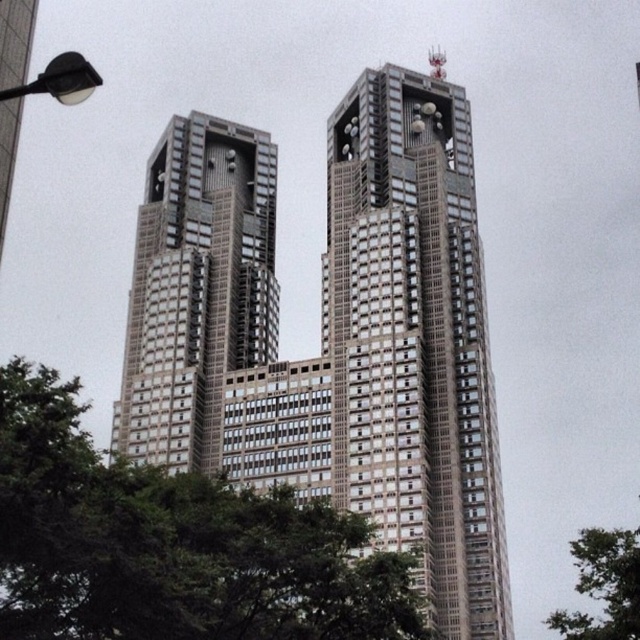
You are standing at the point marked by coordinates point (413, 340) in the image. Looking around, you see the metallic glass skyscraper at center. Which direction should you face to look towards the antennas on top of the metallic glass skyscraper at center?

You should face upwards since the antennas on top of the metallic glass skyscraper at center are located above the point marked by point (413, 340).

You are standing in a plaza in front of the metallic glass skyscraper at center. You want to take a photo of it but need to be at least 50 meters away to capture the entire building in one frame. Are you currently far enough away?

The metallic glass skyscraper at center is 50.45 meters away from viewer, so yes, you are far enough to capture the entire building in one frame since you are slightly beyond the required 50 meters.

You are standing at the base of the left skyscraper and want to walk to the right skyscraper. There is a point at coordinates point (208, 269) and another at point (586, 630). Which point will you encounter first while walking towards the right skyscraper?

You will encounter point (586, 630) first because it is closer to your path towards the right skyscraper, while point (208, 269) is behind it.